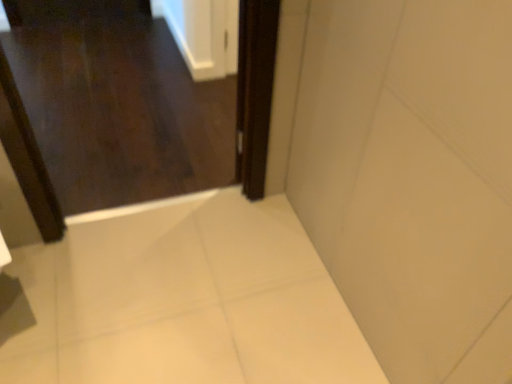
At what (x,y) coordinates should I click in order to perform the action: click on dark wood door at upper left. Please return your answer as a coordinate pair (x, y). Looking at the image, I should click on (117, 104).

The height and width of the screenshot is (384, 512). Describe the element at coordinates (117, 104) in the screenshot. I see `dark wood door at upper left` at that location.

Image resolution: width=512 pixels, height=384 pixels. In order to click on dark wood screen door at center in this screenshot , I will do `click(255, 91)`.

Describe the element at coordinates (255, 91) in the screenshot. The height and width of the screenshot is (384, 512). I see `dark wood screen door at center` at that location.

Find the location of a particular element. dark wood door at upper left is located at coordinates (117, 104).

Is dark wood screen door at center to the right of dark wood door at upper left from the viewer's perspective?

Correct, you'll find dark wood screen door at center to the right of dark wood door at upper left.

Is dark wood screen door at center in front of dark wood door at upper left?

Yes, the depth of dark wood screen door at center is less than that of dark wood door at upper left.

Which is behind, point (271, 82) or point (199, 83)?

The point (199, 83) is behind.

From the image's perspective, would you say dark wood screen door at center is shown under dark wood door at upper left?

Indeed, from the image's perspective, dark wood screen door at center is shown beneath dark wood door at upper left.

From a real-world perspective, is dark wood screen door at center positioned over dark wood door at upper left based on gravity?

Yes, from a real-world perspective, dark wood screen door at center is on top of dark wood door at upper left.

Looking at their sizes, would you say dark wood screen door at center is wider or thinner than dark wood door at upper left?

Considering their sizes, dark wood screen door at center looks slimmer than dark wood door at upper left.

Does dark wood screen door at center have a greater height compared to dark wood door at upper left?

Indeed, dark wood screen door at center has a greater height compared to dark wood door at upper left.

Which of these two, dark wood screen door at center or dark wood door at upper left, is bigger?

dark wood door at upper left.

Looking at this image, would you say dark wood screen door at center contains dark wood door at upper left?

No, dark wood door at upper left is not inside dark wood screen door at center.

Would you say dark wood screen door at center is a long distance from dark wood door at upper left?

dark wood screen door at center is far away from dark wood door at upper left.

Could you tell me if dark wood screen door at center is turned towards dark wood door at upper left?

Yes, dark wood screen door at center is aimed at dark wood door at upper left.

How many degrees apart are the facing directions of dark wood screen door at center and dark wood door at upper left?

The facing directions of dark wood screen door at center and dark wood door at upper left are 114 degrees apart.

Measure the distance from dark wood screen door at center to dark wood door at upper left.

dark wood screen door at center is 1.17 meters away from dark wood door at upper left.

The width and height of the screenshot is (512, 384). In order to click on screen door to the right of dark wood door at upper left in this screenshot , I will do `click(255, 91)`.

Looking at this image, considering the relative positions of dark wood door at upper left and dark wood screen door at center in the image provided, is dark wood door at upper left to the left of dark wood screen door at center from the viewer's perspective?

Yes.

Is dark wood door at upper left behind dark wood screen door at center?

Yes.

Which is closer, (99,52) or (264,173)?

Clearly, point (99,52) is more distant from the camera than point (264,173).

From the image's perspective, who appears lower, dark wood door at upper left or dark wood screen door at center?

dark wood screen door at center appears lower in the image.

From a real-world perspective, is dark wood door at upper left positioned above or below dark wood screen door at center?

dark wood door at upper left is below dark wood screen door at center.

Does dark wood door at upper left have a lesser width compared to dark wood screen door at center?

No.

Does dark wood door at upper left have a greater height compared to dark wood screen door at center?

Incorrect, the height of dark wood door at upper left is not larger of that of dark wood screen door at center.

Does dark wood door at upper left have a smaller size compared to dark wood screen door at center?

Incorrect, dark wood door at upper left is not smaller in size than dark wood screen door at center.

Is dark wood door at upper left surrounding dark wood screen door at center?

That's incorrect, dark wood screen door at center is not inside dark wood door at upper left.

Is dark wood door at upper left placed right next to dark wood screen door at center?

dark wood door at upper left and dark wood screen door at center are not in contact.

From the picture: Could you tell me if dark wood door at upper left is turned towards dark wood screen door at center?

No, dark wood door at upper left is not oriented towards dark wood screen door at center.

Consider the image. How far apart are dark wood door at upper left and dark wood screen door at center?

dark wood door at upper left and dark wood screen door at center are 1.17 meters apart.

Locate an element on the screen. This screenshot has height=384, width=512. door below the dark wood screen door at center (from a real-world perspective) is located at coordinates (117, 104).

This screenshot has height=384, width=512. I want to click on door behind the dark wood screen door at center, so click(x=117, y=104).

The image size is (512, 384). In the image, there is a dark wood screen door at center. What are the coordinates of `door above it (from the image's perspective)` in the screenshot? It's located at (117, 104).